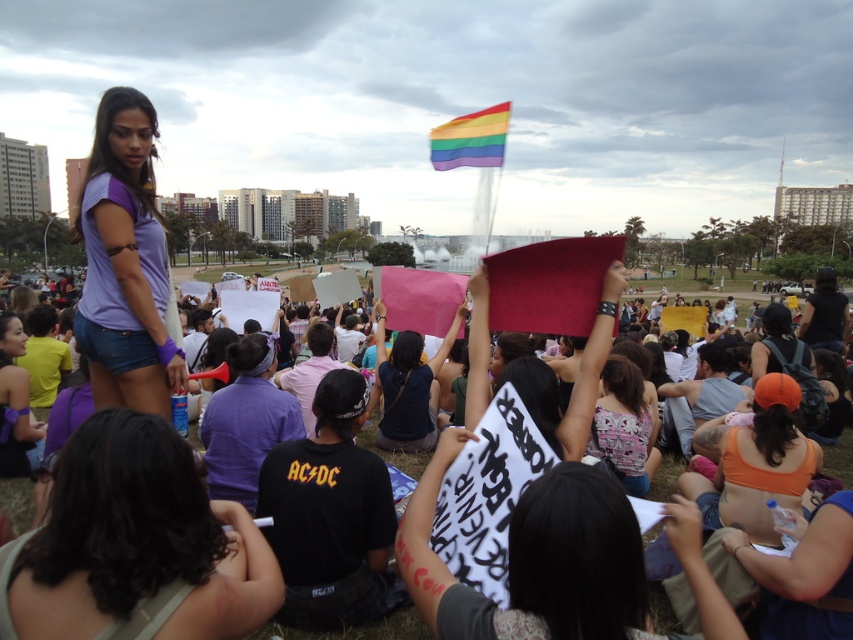
Question: From the image, what is the correct spatial relationship of white paper signs at center in relation to pink floral tank top at center?

Choices:
 (A) above
 (B) below

Answer: (B)

Question: Does purple matte shirt at upper left appear on the right side of white paper signs at center?

Choices:
 (A) yes
 (B) no

Answer: (B)

Question: Which object appears farthest from the camera in this image?

Choices:
 (A) matte pink sign at center
 (B) white paper signs at center

Answer: (A)

Question: Where is orange fabric tank top at lower right located in relation to pink floral tank top at center in the image?

Choices:
 (A) below
 (B) above

Answer: (A)

Question: Which point appears closest to the camera in this image?

Choices:
 (A) (90, 417)
 (B) (86, 225)
 (C) (776, 381)

Answer: (A)

Question: Among these points, which one is farthest from the camera?

Choices:
 (A) (640, 372)
 (B) (248, 637)
 (C) (180, 563)

Answer: (A)